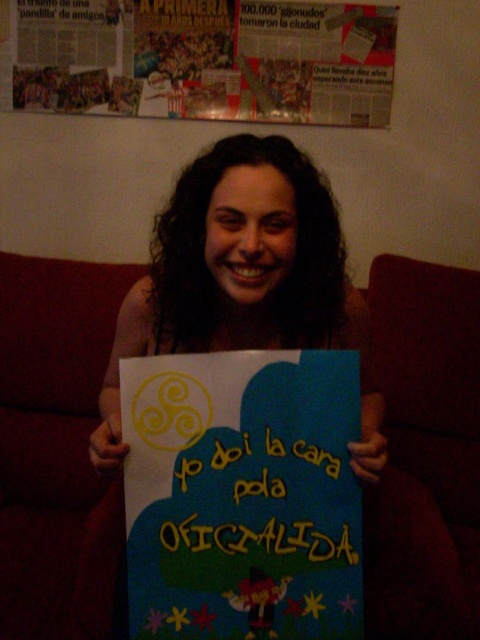
You are an interior designer assessing the space. The client wants to replace the red fabric couch at center with a larger sofa. Considering the blue paper poster at center is currently displayed in the same area, would the new sofa potentially block the poster if placed in the same location?

The red fabric couch at center is currently larger than the blue paper poster at center. If the new sofa is even larger, it would likely block the poster when placed in the same location.

You are standing in the room and want to place a new poster on the wall. There are two points marked on the wall where you can hang it. The first point is at coordinates point [70,584] and the second is at point [295,404]. Which point is closer to the wall behind the couch?

Point [70,584] is behind point [295,404], so the point [70,584] is closer to the wall behind the couch.

You are an interior designer assessing the wall space in this room. The blue paper poster at center and the matte paper poster at upper center need to be hung. Given their sizes, which poster will require more vertical space on the wall?

The blue paper poster at center requires more vertical space because it is much taller than the matte paper poster at upper center.